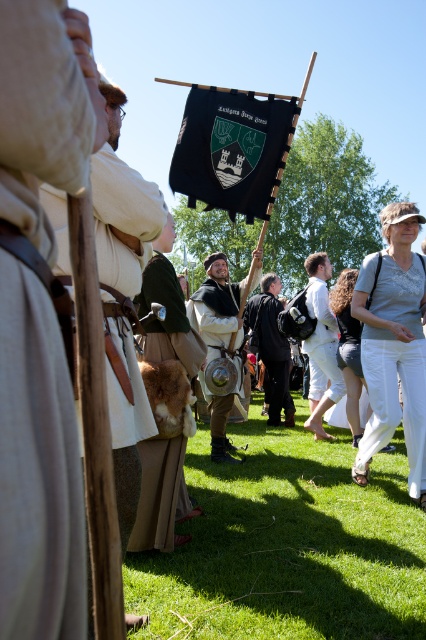
You are a costume designer preparing for a play and need to ensure that the white cotton pants at lower right and the matte brown leather armor at center fit properly. Based on the scene description, which item has a narrower width?

The white cotton pants at lower right has a lesser width compared to the matte brown leather armor at center, so the white cotton pants at lower right is narrower.

You are a participant in the reenactment and need to move from your current position to the point marked at coordinates point [368,428]. However, there is an obstacle at point [227,406]. Can you safely navigate around the obstacle to reach your destination?

Yes, you can safely navigate around the obstacle because point [368,428] is in front of point [227,406], meaning the destination is closer to you than the obstacle, allowing you to move forward without needing to detour around the obstacle.